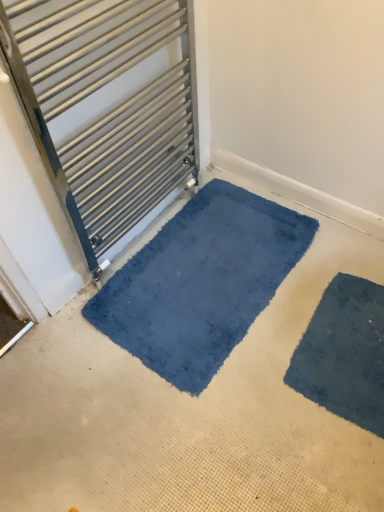
Find the location of `free spot below satin silver towel rail at upper left (from a real-world perspective)`. free spot below satin silver towel rail at upper left (from a real-world perspective) is located at coordinates (141, 234).